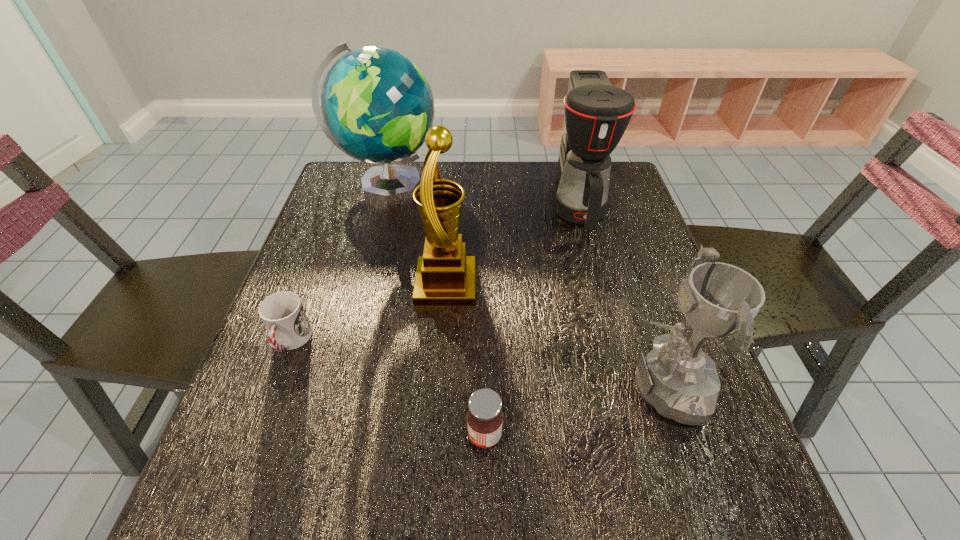
Where is `globe present at the left edge`? globe present at the left edge is located at coordinates (376, 106).

Locate an element on the screen. The height and width of the screenshot is (540, 960). cup that is at the left edge is located at coordinates pos(282,313).

Identify the location of coffee maker located at the right edge. (597, 114).

Find the location of a particular element. This screenshot has height=540, width=960. award that is at the right edge is located at coordinates (678, 379).

Where is `object that is positioned at the far left corner`? object that is positioned at the far left corner is located at coordinates (376, 106).

You are a GUI agent. You are given a task and a screenshot of the screen. Output one action in this format:
    pyautogui.click(x=<x>, y=<y>)
    Task: Click on the object that is positioned at the far right corner
    The image size is (960, 540).
    Given the screenshot: What is the action you would take?
    pyautogui.click(x=597, y=114)

Where is `free space at the far edge of the desktop`? free space at the far edge of the desktop is located at coordinates (505, 172).

Locate an element on the screen. vacant space at the left edge is located at coordinates (307, 390).

The image size is (960, 540). In order to click on vacant area at the right edge in this screenshot , I will do `click(753, 470)`.

Where is `blank space at the far left corner of the desktop`? This screenshot has width=960, height=540. blank space at the far left corner of the desktop is located at coordinates (353, 191).